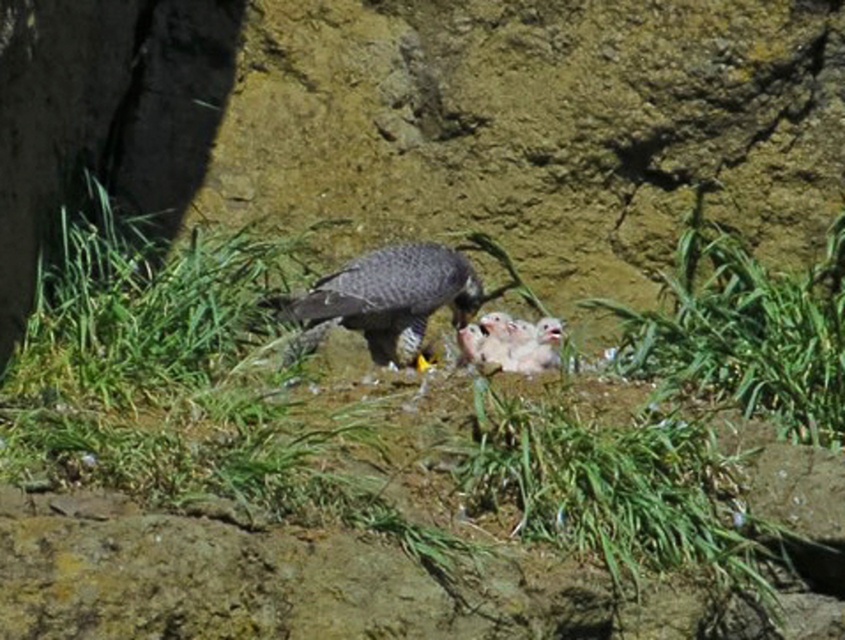
Which is more to the left, green grass at center or dark gray speckled falcon at center?

From the viewer's perspective, green grass at center appears more on the left side.

Is green grass at center below dark gray speckled falcon at center?

Correct, green grass at center is located below dark gray speckled falcon at center.

What do you see at coordinates (347, 483) in the screenshot? The width and height of the screenshot is (845, 640). I see `green grass at center` at bounding box center [347, 483].

This screenshot has width=845, height=640. In order to click on green grass at center in this screenshot , I will do `click(347, 483)`.

Which is above, dark gray speckled falcon at center or soft white downy chicks at center?

dark gray speckled falcon at center is higher up.

Locate an element on the screen. The height and width of the screenshot is (640, 845). dark gray speckled falcon at center is located at coordinates pyautogui.click(x=384, y=300).

Who is taller, green grass at center or soft white downy chicks at center?

With more height is green grass at center.

Is the position of green grass at center less distant than that of soft white downy chicks at center?

Yes, it is in front of soft white downy chicks at center.

Does point (420, 525) lie in front of point (541, 337)?

Yes, it is.

The height and width of the screenshot is (640, 845). What are the coordinates of `green grass at center` in the screenshot? It's located at (347, 483).